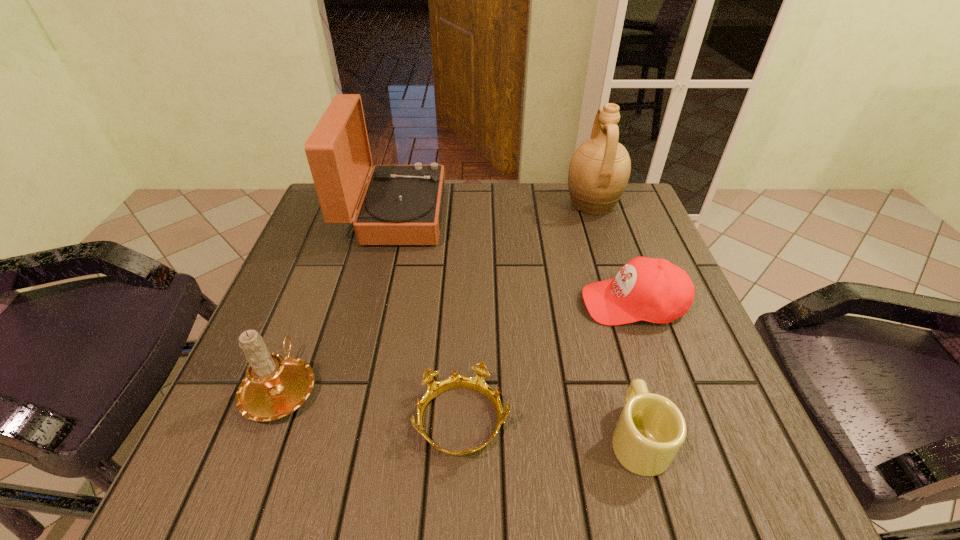
Image resolution: width=960 pixels, height=540 pixels. I want to click on pitcher, so click(x=599, y=170).

You are a GUI agent. You are given a task and a screenshot of the screen. Output one action in this format:
    pyautogui.click(x=<x>, y=<y>)
    Task: Click on the phonograph record
    
    Given the screenshot: What is the action you would take?
    pyautogui.click(x=402, y=204)

The height and width of the screenshot is (540, 960). Identify the location of candle. click(274, 386).

At what (x,y) coordinates should I click in order to perform the action: click on the fourth nearest object. Please return your answer as a coordinate pair (x, y). Looking at the image, I should click on (654, 290).

The image size is (960, 540). I want to click on mug, so click(651, 429).

I want to click on crown, so click(477, 383).

Locate an element on the screen. The height and width of the screenshot is (540, 960). free spot located on the front of the pitcher is located at coordinates (621, 289).

At what (x,y) coordinates should I click in order to perform the action: click on free location located on the face of the phonograph record. Please return your answer as a coordinate pair (x, y). The image size is (960, 540). Looking at the image, I should click on (489, 215).

You are a GUI agent. You are given a task and a screenshot of the screen. Output one action in this format:
    pyautogui.click(x=<x>, y=<y>)
    Task: Click on the free space located on the back of the fourth shortest object
    The image size is (960, 540).
    Given the screenshot: What is the action you would take?
    pyautogui.click(x=318, y=291)

Find the location of a particular element. The image size is (960, 540). free space located on the front panel of the fourth nearest object is located at coordinates (496, 303).